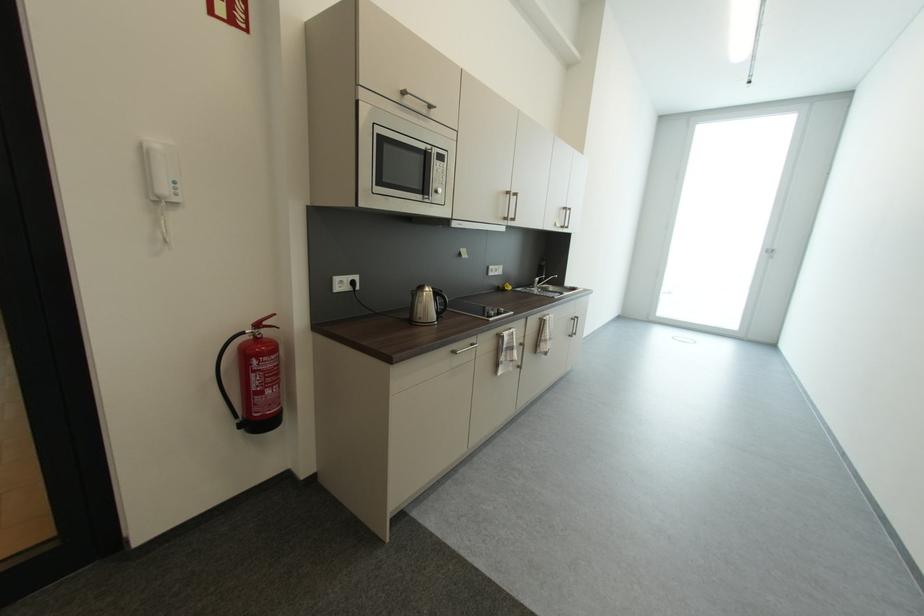
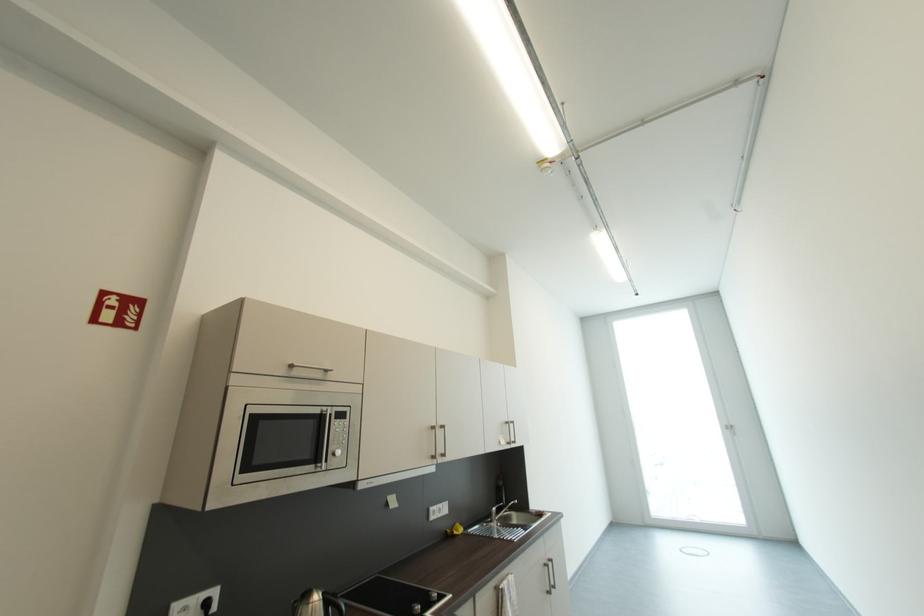
Where in the second image is the point corresponding to (x=570, y=209) from the first image?

(513, 424)